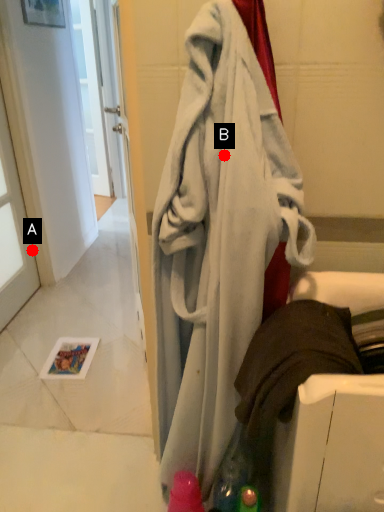
Question: Two points are circled on the image, labeled by A and B beside each circle. Which point is farther from the camera taking this photo?

Choices:
 (A) A is further
 (B) B is further

Answer: (A)